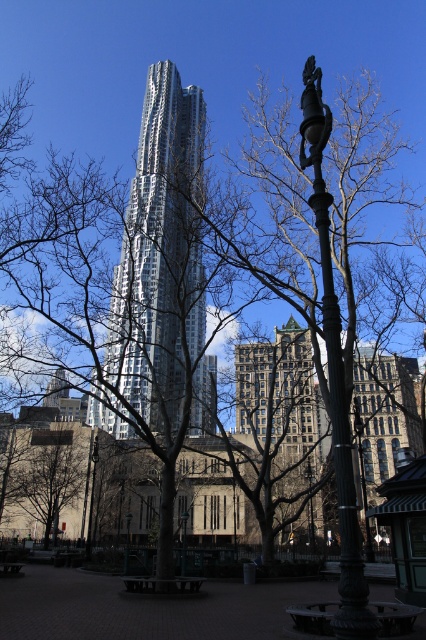
You are a city planner assessing the park layout. You need to install a new bench that requires a 1.2 meter width space between the green patina metal lamp post at right and the green metallic lamp post at center. Is the space between them sufficient?

The green patina metal lamp post at right might be wider than the green metallic lamp post at center, so the space between them may not be sufficient for the 1.2 meter width bench. Further measurement is needed to confirm.

You are standing at the entrance of the park and see two points marked on the ground. The first point is at point (88, 552) and the second is at point (313, 532). Which point is closer to you?

Point (88, 552) is in front of point (313, 532), so it is closer to you.